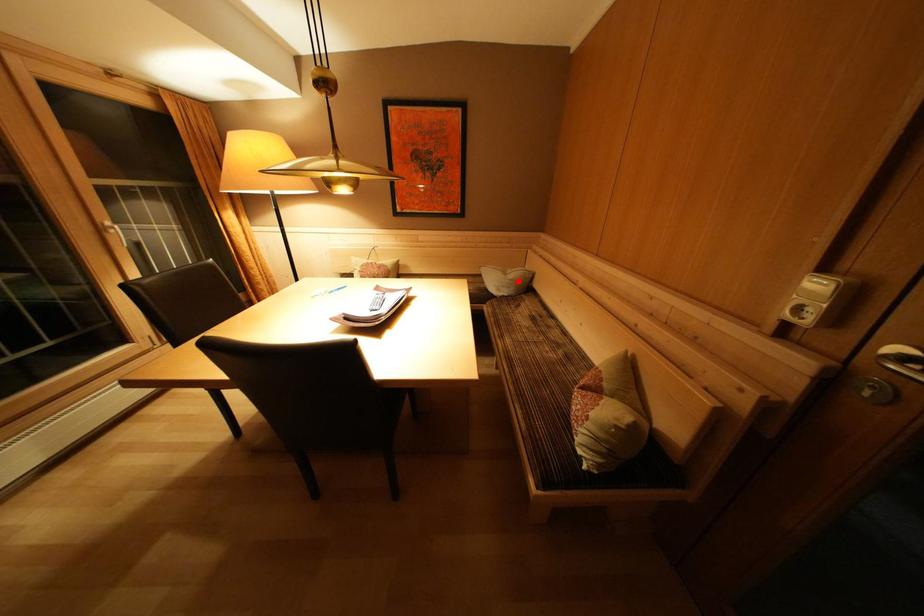
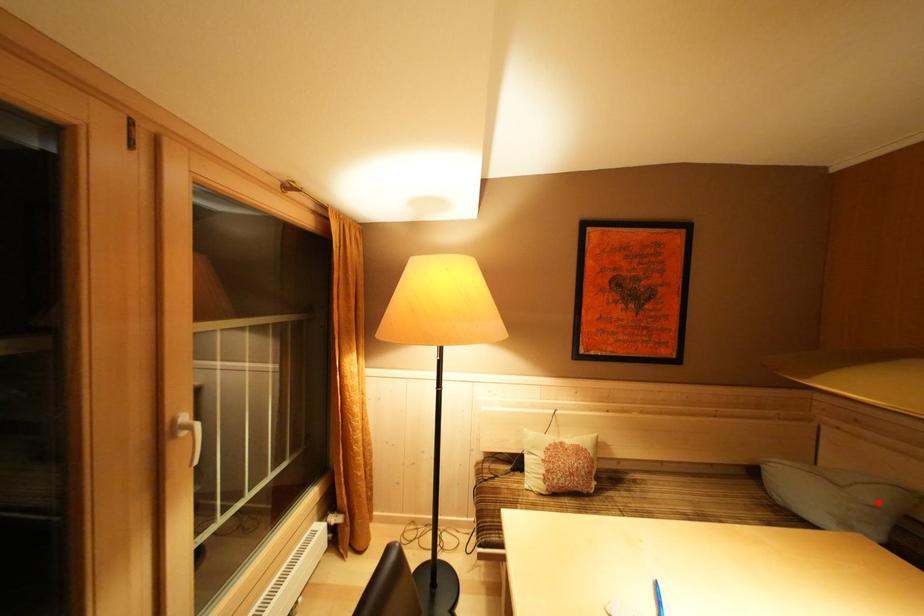
I am providing you with two images of the same scene from different viewpoints. A red point is marked on the first image and another point is marked on the second image. Do the highlighted points in image1 and image2 indicate the same real-world spot?

Yes